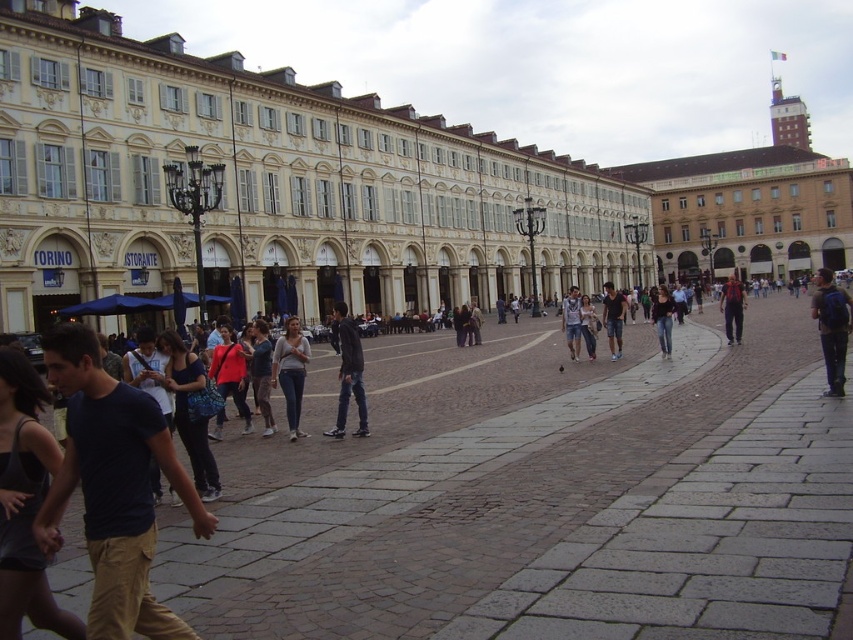
You are a photographer standing at the edge of the square. You notice two people in the center wearing denim shorts at center and jeans at center. Which clothing item is closer to the ground?

The denim shorts at center is positioned under jeans at center, so the denim shorts at center is closer to the ground.